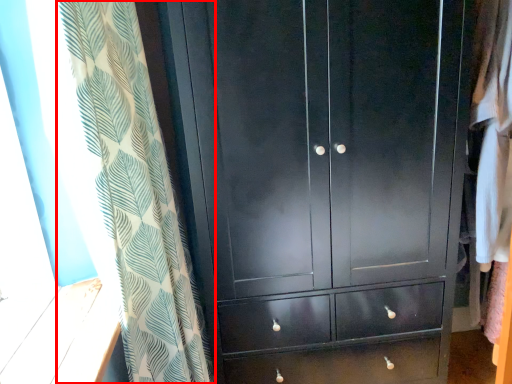
Question: From the image's perspective, where is curtain (annotated by the red box) located relative to cupboard?

Choices:
 (A) above
 (B) below

Answer: (B)